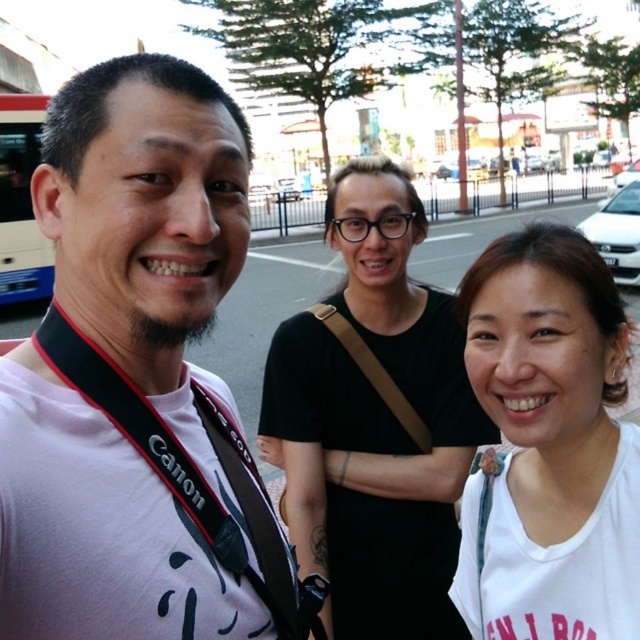
Question: Can you confirm if white matte shirt at center is smaller than blue painted decker bus at left?

Choices:
 (A) no
 (B) yes

Answer: (B)

Question: Which point is closer to the camera taking this photo?

Choices:
 (A) (548, 506)
 (B) (323, 392)
 (C) (160, 76)

Answer: (C)

Question: Is white matte shirt at center positioned behind white matte tank top at center?

Choices:
 (A) yes
 (B) no

Answer: (A)

Question: Which point appears closest to the camera in this image?

Choices:
 (A) (436, 552)
 (B) (13, 118)
 (C) (624, 348)
 (D) (88, 488)

Answer: (D)

Question: Is pink fabric shirt at left further to camera compared to white matte shirt at center?

Choices:
 (A) no
 (B) yes

Answer: (A)

Question: Which point is closer to the camera?

Choices:
 (A) (26, 285)
 (B) (234, 506)
 (C) (490, 426)
 (D) (596, 256)

Answer: (B)